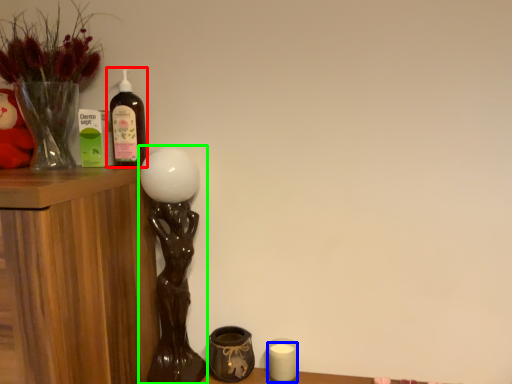
Question: Which object is the closest to the bottle (highlighted by a red box)? Choose among these: candle (highlighted by a blue box) or table lamp (highlighted by a green box).

Choices:
 (A) candle
 (B) table lamp

Answer: (B)